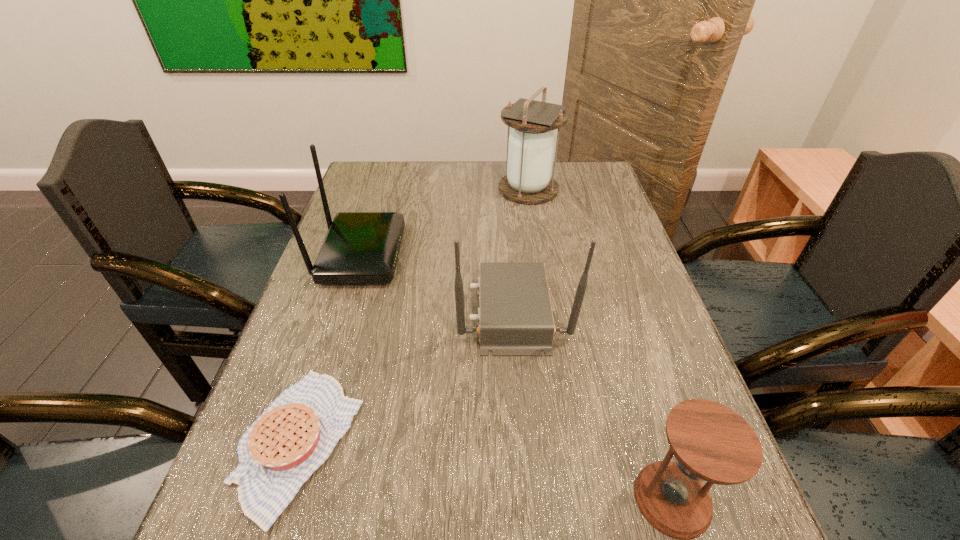
Identify the location of the farthest object. (530, 147).

You are a GUI agent. You are given a task and a screenshot of the screen. Output one action in this format:
    pyautogui.click(x=<x>, y=<y>)
    Task: Click on the right router
    
    Given the screenshot: What is the action you would take?
    pyautogui.click(x=515, y=318)

Where is `the left router`? The image size is (960, 540). the left router is located at coordinates click(360, 247).

Where is `pie`? pie is located at coordinates (293, 437).

The image size is (960, 540). I want to click on blank area located 0.240m on the front of the farthest object, so click(539, 255).

Identify the location of blank area located 0.360m on the back of the right router to connect cables. (305, 311).

Where is `vacant space located on the back of the right router to connect cables`? The image size is (960, 540). vacant space located on the back of the right router to connect cables is located at coordinates (370, 311).

Identify the location of free space located on the back of the right router to connect cables. Image resolution: width=960 pixels, height=540 pixels. (335, 311).

Where is `free region located 0.280m on the front-facing side of the left router`? The width and height of the screenshot is (960, 540). free region located 0.280m on the front-facing side of the left router is located at coordinates (505, 254).

Where is `free space located 0.350m on the back of the pie`? The height and width of the screenshot is (540, 960). free space located 0.350m on the back of the pie is located at coordinates (356, 263).